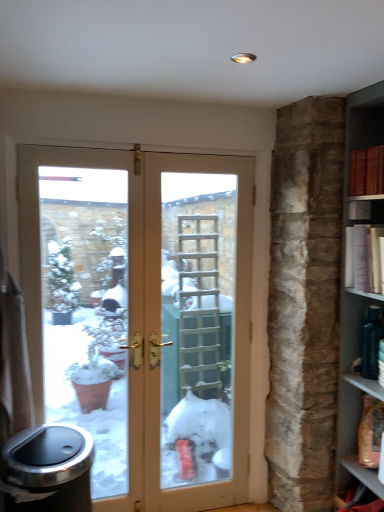
What do you see at coordinates (363, 474) in the screenshot? The height and width of the screenshot is (512, 384). I see `matte brown wood at lower right` at bounding box center [363, 474].

At what (x,y) coordinates should I click in order to perform the action: click on red leather book at upper right, the first book from the top. Please return your answer as a coordinate pair (x, y). This screenshot has width=384, height=512. Looking at the image, I should click on 367,170.

Between matte brown wood at lower right and red leather book at upper right, positioned as the 2th book in bottom-to-top order, which one appears on the left side from the viewer's perspective?

red leather book at upper right, positioned as the 2th book in bottom-to-top order.

Would you say matte brown wood at lower right is inside or outside red leather book at upper right, the first book from the top?

matte brown wood at lower right is located beyond the bounds of red leather book at upper right, the first book from the top.

Is matte brown wood at lower right placed right next to red leather book at upper right, positioned as the 2th book in bottom-to-top order?

No, matte brown wood at lower right is not with red leather book at upper right, positioned as the 2th book in bottom-to-top order.

Considering the sizes of objects red leather book at upper right, positioned as the 2th book in bottom-to-top order, and shiny metallic trash can at lower left in the image provided, who is shorter, red leather book at upper right, positioned as the 2th book in bottom-to-top order, or shiny metallic trash can at lower left?

Standing shorter between the two is red leather book at upper right, positioned as the 2th book in bottom-to-top order.

From a real-world perspective, between red leather book at upper right, positioned as the 2th book in bottom-to-top order, and shiny metallic trash can at lower left, who is vertically higher?

red leather book at upper right, positioned as the 2th book in bottom-to-top order, is physically above.

In the image, is red leather book at upper right, the first book from the top, on the left side or the right side of shiny metallic trash can at lower left?

From the image, it's evident that red leather book at upper right, the first book from the top, is to the right of shiny metallic trash can at lower left.

Identify the location of garbage lying in front of the red leather book at upper right, positioned as the 2th book in bottom-to-top order. This screenshot has width=384, height=512. (48, 470).

Is shiny metallic trash can at lower left positioned with its back to white paper bookshelf at right, marked as the second book in a top-to-bottom arrangement?

No, shiny metallic trash can at lower left's orientation is not away from white paper bookshelf at right, marked as the second book in a top-to-bottom arrangement.

Consider the image. Is shiny metallic trash can at lower left taller than white paper bookshelf at right, marked as the second book in a top-to-bottom arrangement?

Yes.

From the image's perspective, is shiny metallic trash can at lower left on white paper bookshelf at right, marked as the second book in a top-to-bottom arrangement?

Actually, shiny metallic trash can at lower left appears below white paper bookshelf at right, marked as the second book in a top-to-bottom arrangement, in the image.

Does point (349, 193) appear closer or farther from the camera than point (347, 285)?

Point (349, 193).

Between red leather book at upper right, positioned as the 2th book in bottom-to-top order, and white paper bookshelf at right, which is the first book in bottom-to-top order, which one is positioned behind?

red leather book at upper right, positioned as the 2th book in bottom-to-top order.

Based on the photo, is red leather book at upper right, the first book from the top, with white paper bookshelf at right, which is the first book in bottom-to-top order?

No, red leather book at upper right, the first book from the top, is not beside white paper bookshelf at right, which is the first book in bottom-to-top order.

Is red leather book at upper right, positioned as the 2th book in bottom-to-top order, next to matte brown wood at lower right and touching it?

No, red leather book at upper right, positioned as the 2th book in bottom-to-top order, is not next to matte brown wood at lower right.

Looking at this image, which object is positioned more to the left, red leather book at upper right, positioned as the 2th book in bottom-to-top order, or matte brown wood at lower right?

red leather book at upper right, positioned as the 2th book in bottom-to-top order.

Does red leather book at upper right, positioned as the 2th book in bottom-to-top order, turn towards matte brown wood at lower right?

No, red leather book at upper right, positioned as the 2th book in bottom-to-top order, is not oriented towards matte brown wood at lower right.

Would you say matte brown wood at lower right is to the left or to the right of white paper bookshelf at right, which is the first book in bottom-to-top order, in the picture?

In the image, matte brown wood at lower right appears on the left side of white paper bookshelf at right, which is the first book in bottom-to-top order.

How many degrees apart are the facing directions of matte brown wood at lower right and white paper bookshelf at right, which is the first book in bottom-to-top order?

There is a 3.16-degree angle between the facing directions of matte brown wood at lower right and white paper bookshelf at right, which is the first book in bottom-to-top order.

Where is `the 1st book above when counting from the matte brown wood at lower right (from the image's perspective)`? The height and width of the screenshot is (512, 384). the 1st book above when counting from the matte brown wood at lower right (from the image's perspective) is located at coordinates (363, 258).

Between point (354, 468) and point (369, 283), which one is positioned behind?

The point (354, 468) is more distant.

Who is more distant, shiny metallic trash can at lower left or red leather book at upper right, the first book from the top?

red leather book at upper right, the first book from the top.

From the image's perspective, which book is the 2nd one above the shiny metallic trash can at lower left? Please provide its 2D coordinates.

[(367, 170)]

How different are the orientations of shiny metallic trash can at lower left and red leather book at upper right, the first book from the top, in degrees?

The facing directions of shiny metallic trash can at lower left and red leather book at upper right, the first book from the top, are 86.1 degrees apart.

Would you say shiny metallic trash can at lower left contains red leather book at upper right, positioned as the 2th book in bottom-to-top order?

That's incorrect, red leather book at upper right, positioned as the 2th book in bottom-to-top order, is not inside shiny metallic trash can at lower left.

From a real-world perspective, count 2nd books upward from the matte brown wood at lower right and point to it. Please provide its 2D coordinates.

[(367, 170)]

From the image's perspective, which book is the 2nd one above the shiny metallic trash can at lower left? Please provide its 2D coordinates.

[(367, 170)]

From the image, which object appears to be farther from red leather book at upper right, positioned as the 2th book in bottom-to-top order, matte brown wood at lower right or shiny metallic trash can at lower left?

shiny metallic trash can at lower left.

Looking at the image, which one is located closer to shiny metallic trash can at lower left, red leather book at upper right, positioned as the 2th book in bottom-to-top order, or white paper bookshelf at right, which is the first book in bottom-to-top order?

The object closer to shiny metallic trash can at lower left is white paper bookshelf at right, which is the first book in bottom-to-top order.

Considering their positions, is white paper bookshelf at right, marked as the second book in a top-to-bottom arrangement, positioned further to matte brown wood at lower right than shiny metallic trash can at lower left?

shiny metallic trash can at lower left.

When comparing their distances from white paper bookshelf at right, which is the first book in bottom-to-top order, does matte brown wood at lower right or red leather book at upper right, positioned as the 2th book in bottom-to-top order, seem closer?

Based on the image, red leather book at upper right, positioned as the 2th book in bottom-to-top order, appears to be nearer to white paper bookshelf at right, which is the first book in bottom-to-top order.

Estimate the real-world distances between objects in this image. Which object is further from red leather book at upper right, positioned as the 2th book in bottom-to-top order, shiny metallic trash can at lower left or matte brown wood at lower right?

shiny metallic trash can at lower left is further to red leather book at upper right, positioned as the 2th book in bottom-to-top order.

Estimate the real-world distances between objects in this image. Which object is closer to matte brown wood at lower right, red leather book at upper right, the first book from the top, or white paper bookshelf at right, marked as the second book in a top-to-bottom arrangement?

white paper bookshelf at right, marked as the second book in a top-to-bottom arrangement, is closer to matte brown wood at lower right.

Based on their spatial positions, is matte brown wood at lower right or white paper bookshelf at right, which is the first book in bottom-to-top order, further from shiny metallic trash can at lower left?

Among the two, white paper bookshelf at right, which is the first book in bottom-to-top order, is located further to shiny metallic trash can at lower left.

From the picture: When comparing their distances from white paper bookshelf at right, which is the first book in bottom-to-top order, does red leather book at upper right, the first book from the top, or matte brown wood at lower right seem further?

The object further to white paper bookshelf at right, which is the first book in bottom-to-top order, is matte brown wood at lower right.

Where is `book between shiny metallic trash can at lower left and white paper bookshelf at right, which is the first book in bottom-to-top order, from left to right`? The height and width of the screenshot is (512, 384). book between shiny metallic trash can at lower left and white paper bookshelf at right, which is the first book in bottom-to-top order, from left to right is located at coordinates (367, 170).

At what (x,y) coordinates should I click in order to perform the action: click on garbage that lies between red leather book at upper right, positioned as the 2th book in bottom-to-top order, and matte brown wood at lower right from top to bottom. Please return your answer as a coordinate pair (x, y). The image size is (384, 512). Looking at the image, I should click on (48, 470).

You are a GUI agent. You are given a task and a screenshot of the screen. Output one action in this format:
    pyautogui.click(x=<x>, y=<y>)
    Task: Click on the book between red leather book at upper right, the first book from the top, and matte brown wood at lower right vertically
    
    Given the screenshot: What is the action you would take?
    pyautogui.click(x=363, y=258)

The width and height of the screenshot is (384, 512). I want to click on window sill situated between shiny metallic trash can at lower left and white paper bookshelf at right, which is the first book in bottom-to-top order, from left to right, so click(x=363, y=474).